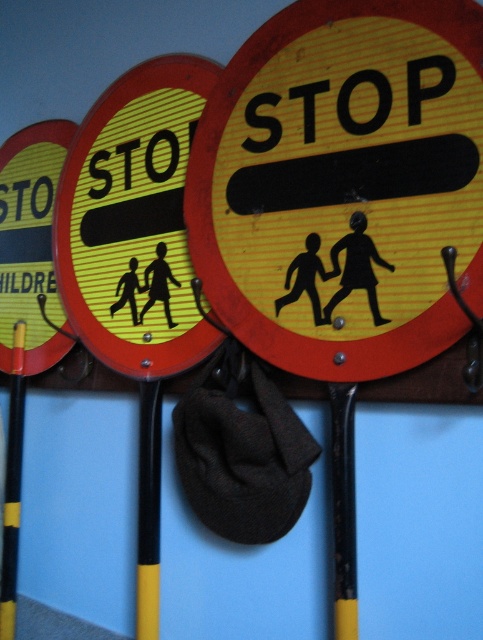
Which is in front, point (355, 625) or point (11, 468)?

Point (355, 625) is in front.

Does black plastic pole at center appear over yellow/black pole at center?

Yes.

Does point (345, 512) come behind point (6, 467)?

No, (345, 512) is closer to viewer.

At what (x,y) coordinates should I click in order to perform the action: click on black plastic pole at center. Please return your answer as a coordinate pair (x, y). Looking at the image, I should click on (343, 508).

Does yellowmaterial/texturesign at center appear on the right side of yellow/black pole at center?

Indeed, yellowmaterial/texturesign at center is positioned on the right side of yellow/black pole at center.

Locate an element on the screen. The height and width of the screenshot is (640, 483). yellowmaterial/texturesign at center is located at coordinates (133, 221).

Does yellowmaterial/texturesign at center appear over yellow plastic pole at center?

Indeed, yellowmaterial/texturesign at center is positioned over yellow plastic pole at center.

Who is taller, yellowmaterial/texturesign at center or yellow plastic pole at center?

With more height is yellowmaterial/texturesign at center.

This screenshot has height=640, width=483. I want to click on yellowmaterial/texturesign at center, so click(133, 221).